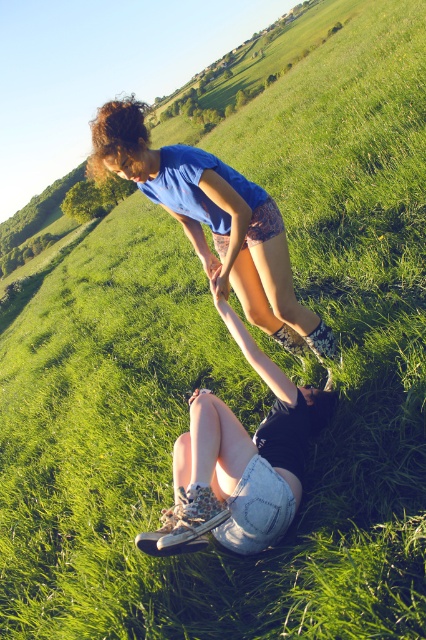
Question: Is blue fabric shorts at center thinner than denim shorts at center?

Choices:
 (A) yes
 (B) no

Answer: (B)

Question: Does blue fabric shorts at center have a greater width compared to denim shorts at center?

Choices:
 (A) no
 (B) yes

Answer: (B)

Question: Which object appears farthest from the camera in this image?

Choices:
 (A) blue fabric shorts at center
 (B) denim shorts at center

Answer: (A)

Question: Which point appears farthest from the camera in this image?

Choices:
 (A) (284, 515)
 (B) (141, 113)

Answer: (B)

Question: Which point appears farthest from the camera in this image?

Choices:
 (A) (284, 500)
 (B) (229, 195)

Answer: (B)

Question: Does blue fabric shorts at center have a larger size compared to denim shorts at center?

Choices:
 (A) yes
 (B) no

Answer: (A)